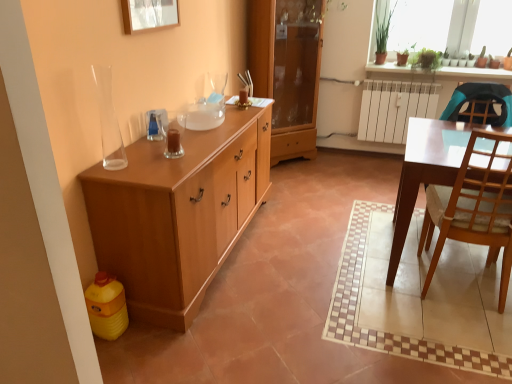
Identify the location of free location to the left of light brown wooden chair at right. (368, 281).